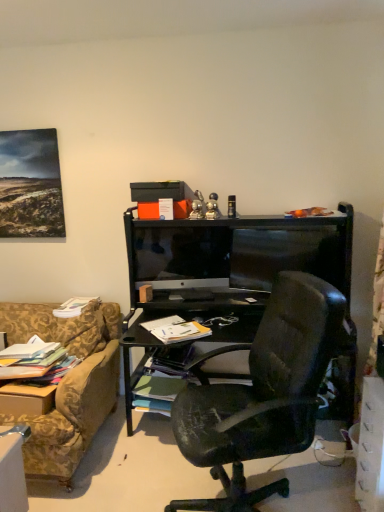
Question: From a real-world perspective, is green matte book at center, which ranks as the 2th book in right-to-left order, above or below white paper at center, placed as the 4th book when sorted from left to right?

Choices:
 (A) below
 (B) above

Answer: (A)

Question: Considering the relative positions of green matte book at center, which appears as the third book when viewed from the left, and white paper at center, which is counted as the 2th book, starting from the top, in the image provided, is green matte book at center, which appears as the third book when viewed from the left, to the left or to the right of white paper at center, which is counted as the 2th book, starting from the top,?

Choices:
 (A) left
 (B) right

Answer: (A)

Question: Estimate the real-world distances between objects in this image. Which object is farther from the matte black box at upper center?

Choices:
 (A) green matte book at center, which ranks as the 2th book in right-to-left order
 (B) white paper at center, placed as the 4th book when sorted from left to right
 (C) white paper book at lower left, positioned as the 1th book in top-to-bottom order
 (D) white plastic drawer at lower right
 (E) multicolored paper stack at left, which is the 4th book from right to left

Answer: (D)

Question: Considering the real-world distances, which object is farthest from the white paper book at lower left, which appears as the third book when viewed from the right?

Choices:
 (A) multicolored paper stack at left, which is the 4th book from right to left
 (B) black glossy monitor at center
 (C) green matte book at center, acting as the 1th book starting from the bottom
 (D) white plastic drawer at lower right
 (E) matte black box at upper center

Answer: (D)